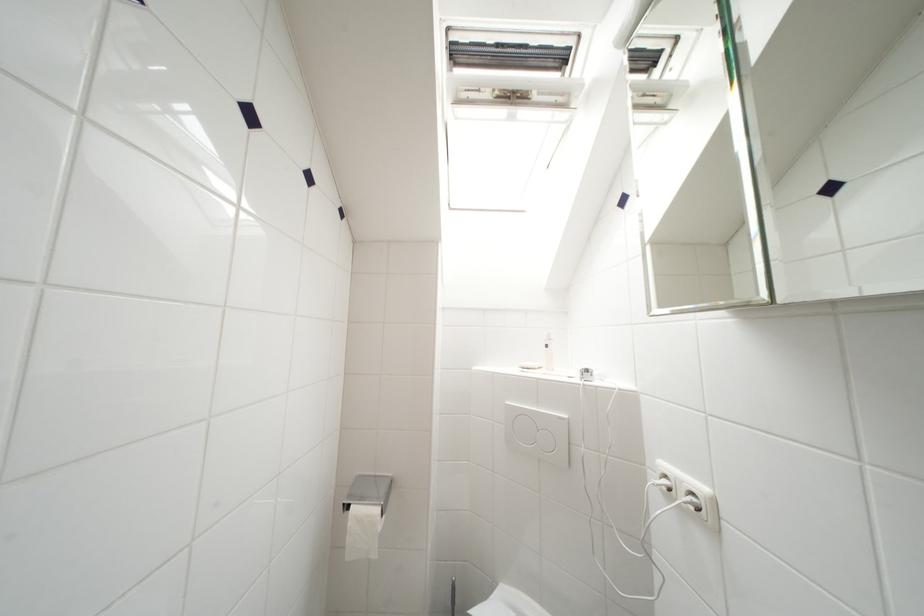
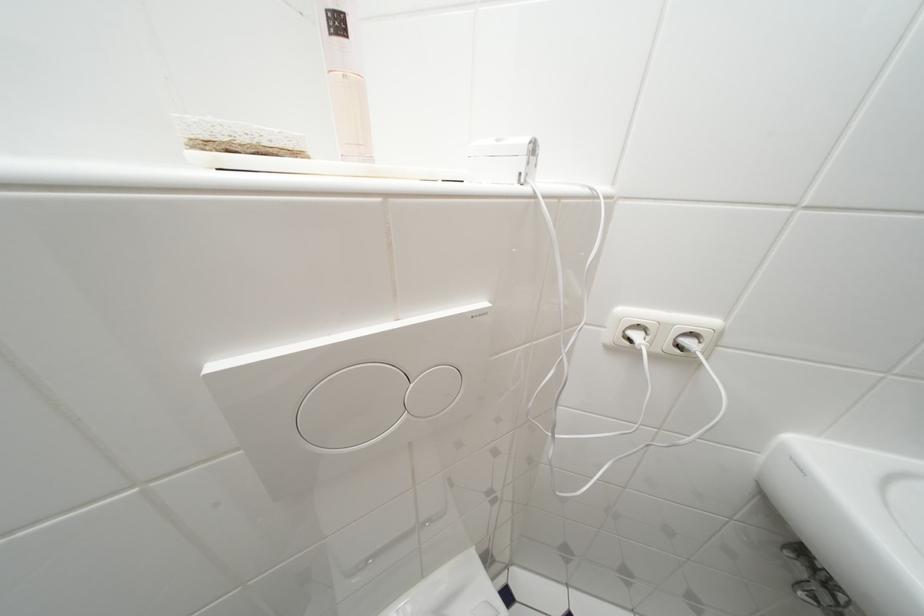
Find the pixel in the second image that matches the point at 553,350 in the first image.

(345, 26)